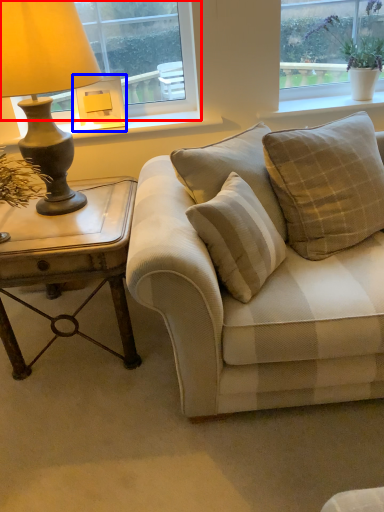
Question: Which object is closer to the camera taking this photo, window (highlighted by a red box) or lamp (highlighted by a blue box)?

Choices:
 (A) window
 (B) lamp

Answer: (A)